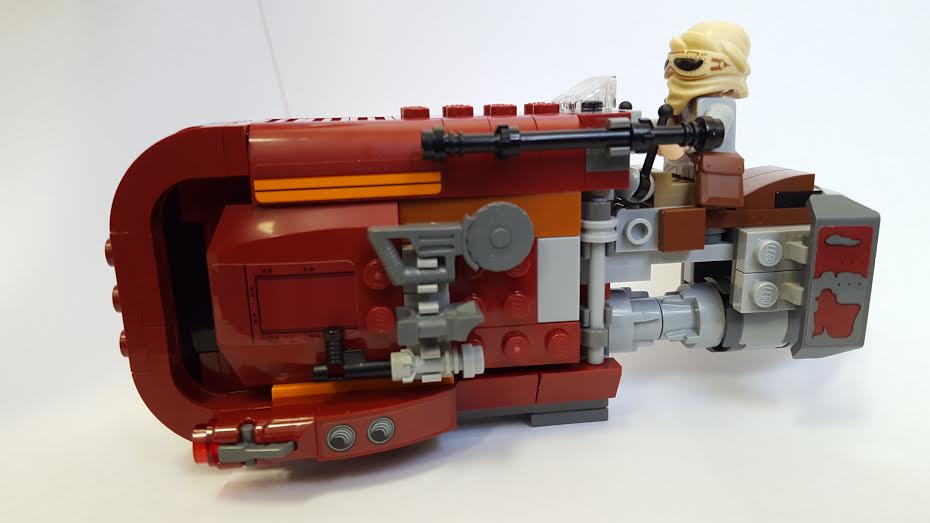
Where is `light`? Image resolution: width=930 pixels, height=523 pixels. light is located at coordinates (380, 428).